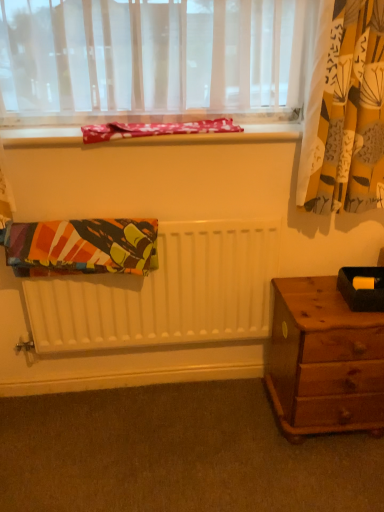
Where is `free point above wooden nightstand at lower right (from a real-world perspective)`? Image resolution: width=384 pixels, height=512 pixels. free point above wooden nightstand at lower right (from a real-world perspective) is located at coordinates (325, 294).